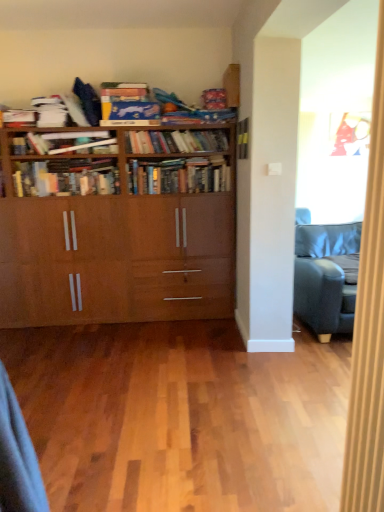
Question: Is hardcover books at center, acting as the 6th book starting from the top, located outside wooden bookshelf at center, marked as the second book in a top-to-bottom arrangement?

Choices:
 (A) no
 (B) yes

Answer: (B)

Question: From the image's perspective, is hardcover books at center, the first book positioned from the bottom, on wooden bookshelf at center, which is the fifth book from bottom to top?

Choices:
 (A) yes
 (B) no

Answer: (B)

Question: Can you confirm if hardcover books at center, the first book positioned from the bottom, is shorter than wooden bookshelf at center, marked as the second book in a top-to-bottom arrangement?

Choices:
 (A) no
 (B) yes

Answer: (A)

Question: Is hardcover books at center, the first book positioned from the bottom, positioned behind wooden bookshelf at center, which is the fifth book from bottom to top?

Choices:
 (A) no
 (B) yes

Answer: (A)

Question: Is hardcover books at center, acting as the 6th book starting from the top, oriented away from wooden bookshelf at center, marked as the second book in a top-to-bottom arrangement?

Choices:
 (A) yes
 (B) no

Answer: (B)

Question: From their relative heights in the image, would you say light brown wood floor at center is taller or shorter than hardcover books at center, the 2th book positioned from the bottom?

Choices:
 (A) tall
 (B) short

Answer: (B)

Question: In terms of width, does light brown wood floor at center look wider or thinner when compared to hardcover books at center, arranged as the 5th book when viewed from the top?

Choices:
 (A) wide
 (B) thin

Answer: (A)

Question: Would you say light brown wood floor at center is inside or outside hardcover books at center, arranged as the 5th book when viewed from the top?

Choices:
 (A) inside
 (B) outside

Answer: (B)

Question: From the image's perspective, is light brown wood floor at center positioned above or below hardcover books at center, the 2th book positioned from the bottom?

Choices:
 (A) above
 (B) below

Answer: (B)

Question: Visually, is wooden bookshelf at center, marked as the second book in a top-to-bottom arrangement, positioned to the left or to the right of matte black book at center, which is the third book in bottom-to-top order?

Choices:
 (A) left
 (B) right

Answer: (A)

Question: From a real-world perspective, is wooden bookshelf at center, marked as the second book in a top-to-bottom arrangement, above or below matte black book at center, acting as the fourth book starting from the top?

Choices:
 (A) above
 (B) below

Answer: (B)

Question: From the image's perspective, relative to matte black book at center, which is the third book in bottom-to-top order, is wooden bookshelf at center, marked as the second book in a top-to-bottom arrangement, above or below?

Choices:
 (A) above
 (B) below

Answer: (A)

Question: From their relative heights in the image, would you say wooden bookshelf at center, which is the fifth book from bottom to top, is taller or shorter than matte black book at center, which is the third book in bottom-to-top order?

Choices:
 (A) tall
 (B) short

Answer: (B)

Question: Is hardcover books at center, arranged as the 5th book when viewed from the top, wider or thinner than wooden bookcase at center?

Choices:
 (A) thin
 (B) wide

Answer: (A)

Question: In terms of height, does hardcover books at center, arranged as the 5th book when viewed from the top, look taller or shorter compared to wooden bookcase at center?

Choices:
 (A) tall
 (B) short

Answer: (B)